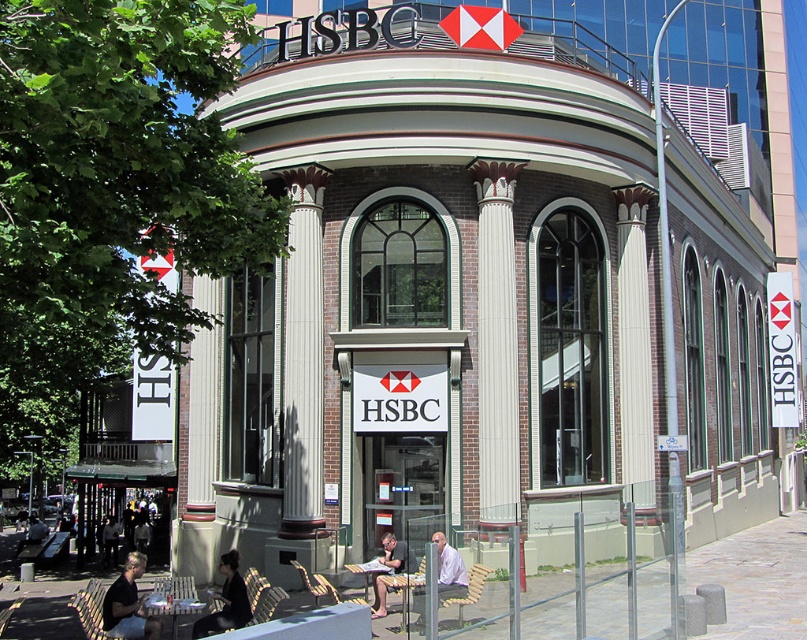
Can you confirm if light brown wooden bench at center is positioned to the right of dark gray shirt at lower left?

Indeed, light brown wooden bench at center is positioned on the right side of dark gray shirt at lower left.

Between point (383, 596) and point (44, 525), which one is positioned in front?

Point (383, 596) is in front.

Between point (378, 573) and point (15, 554), which one is positioned in front?

Point (378, 573) is in front.

Find the location of `light brown wooden bench at center`. light brown wooden bench at center is located at coordinates (391, 570).

Looking at this image, does white marble column at center come in front of smooth white shirt at center?

No, it is not.

Who is lower down, white marble column at center or smooth white shirt at center?

Positioned lower is smooth white shirt at center.

Is point (487, 506) positioned in front of point (463, 593)?

No.

This screenshot has height=640, width=807. What are the coordinates of `white marble column at center` in the screenshot? It's located at (496, 348).

Which is more to the left, smooth white shirt at center or dark gray shirt at lower left?

dark gray shirt at lower left

Which is more to the right, smooth white shirt at center or dark gray shirt at lower left?

smooth white shirt at center is more to the right.

Does point (444, 568) come behind point (36, 538)?

No, (444, 568) is closer to viewer.

At what (x,y) coordinates should I click in order to perform the action: click on smooth white shirt at center. Please return your answer as a coordinate pair (x, y). Looking at the image, I should click on (449, 570).